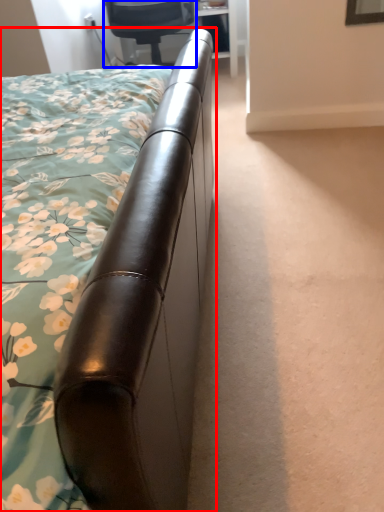
Question: Which point is further to the camera, bed (highlighted by a red box) or chair (highlighted by a blue box)?

Choices:
 (A) bed
 (B) chair

Answer: (B)